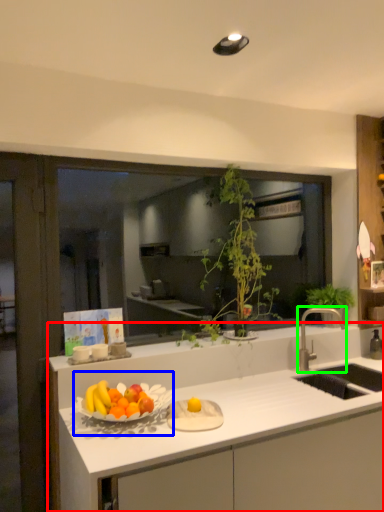
Question: Which is farther away from countertop (highlighted by a red box)? fruit dish (highlighted by a blue box) or tap (highlighted by a green box)?

Choices:
 (A) fruit dish
 (B) tap

Answer: (B)